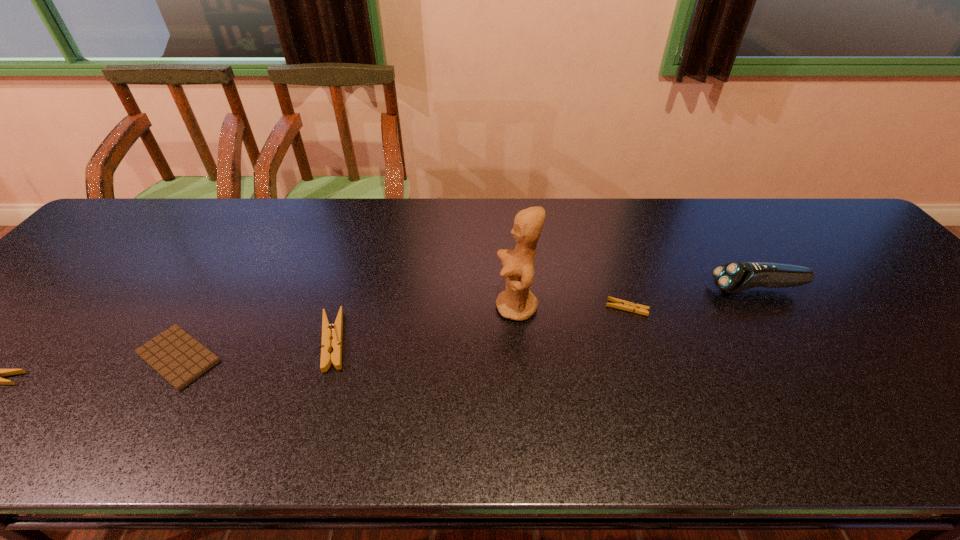
Where is `vacant space located on the right of the tallest clothespin`? vacant space located on the right of the tallest clothespin is located at coordinates (446, 341).

The height and width of the screenshot is (540, 960). Find the location of `vacant space located on the left of the rightmost clothespin`. vacant space located on the left of the rightmost clothespin is located at coordinates (509, 308).

The width and height of the screenshot is (960, 540). Identify the location of vacant space located 0.270m on the back of the chocolate bar. (242, 253).

The width and height of the screenshot is (960, 540). I want to click on blank area located on the front-facing side of the tallest object, so click(x=390, y=307).

The height and width of the screenshot is (540, 960). I want to click on vacant space situated on the front-facing side of the tallest object, so click(419, 307).

Where is `free space located on the front-facing side of the tallest object`? The image size is (960, 540). free space located on the front-facing side of the tallest object is located at coordinates (353, 307).

Locate an element on the screen. This screenshot has height=540, width=960. vacant space located 0.280m on the head of the fifth shortest object is located at coordinates (603, 289).

Where is `free point located on the head of the fifth shortest object`? free point located on the head of the fifth shortest object is located at coordinates (677, 289).

Where is `vacant space located 0.220m on the head of the fifth shortest object`? The height and width of the screenshot is (540, 960). vacant space located 0.220m on the head of the fifth shortest object is located at coordinates (626, 289).

Find the location of a particular element. The height and width of the screenshot is (540, 960). clothespin located in the near edge section of the desktop is located at coordinates (329, 331).